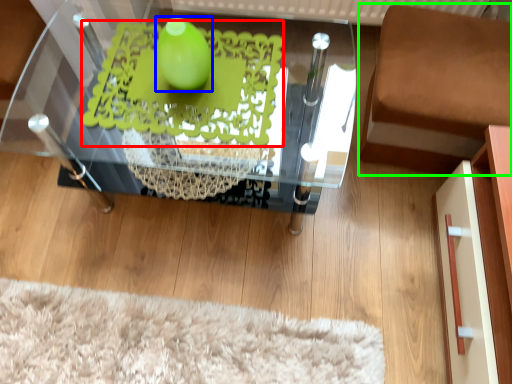
Question: Based on their relative distances, which object is farther from design (highlighted by a red box)? Choose from lime (highlighted by a blue box) and furniture (highlighted by a green box).

Choices:
 (A) lime
 (B) furniture

Answer: (B)